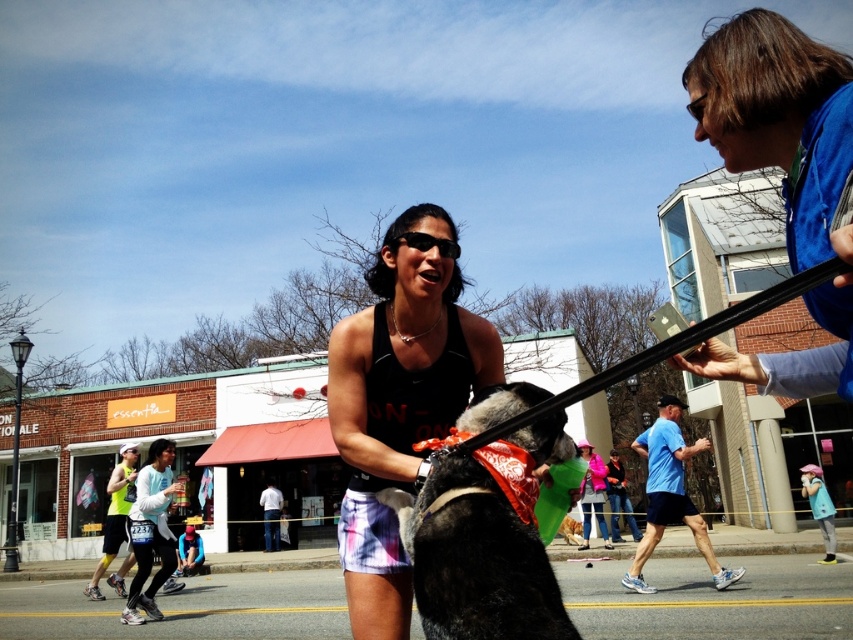
Question: Does matte black tank top at center have a larger size compared to black fur dog at center?

Choices:
 (A) yes
 (B) no

Answer: (A)

Question: Which point is farther to the camera?

Choices:
 (A) blue fabric at upper right
 (B) matte black tank top at center

Answer: (B)

Question: Based on their relative distances, which object is farther from the blue fabric at upper right?

Choices:
 (A) black fur dog at center
 (B) matte black tank top at center

Answer: (B)

Question: Among these points, which one is farthest from the camera?

Choices:
 (A) (695, 56)
 (B) (457, 273)

Answer: (B)

Question: Is matte black tank top at center smaller than black fur dog at center?

Choices:
 (A) no
 (B) yes

Answer: (A)

Question: Is matte black tank top at center smaller than black fur dog at center?

Choices:
 (A) yes
 (B) no

Answer: (B)